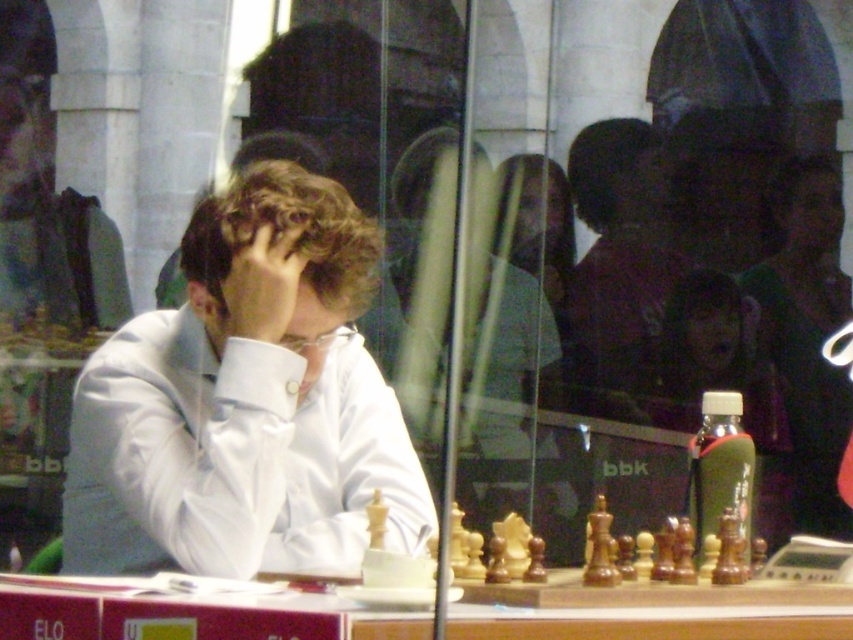
You are a photographer taking a picture of the scene. You need to focus on both the white glossy shirt at center and the wooden at center. Which object should you adjust your camera focus to first if you want to ensure both are in focus, considering their positions?

The white glossy shirt at center is positioned on the left side of wooden at center. To ensure both are in focus, you should focus on the white glossy shirt at center first since it is closer to the camera, allowing the wooden at center to fall within the depth of field.